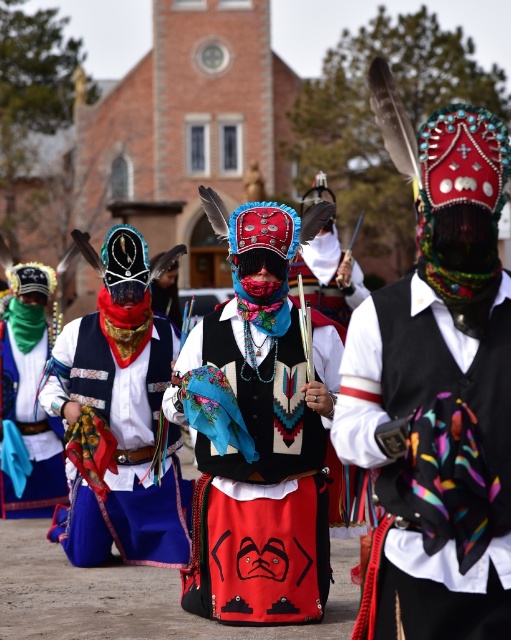
Question: Among these objects, which one is nearest to the camera?

Choices:
 (A) blue fabric skirt at center
 (B) embroidered fabric skirt at center
 (C) green satin scarf at left

Answer: (B)

Question: Among these points, which one is farthest from the camera?

Choices:
 (A) (184, 557)
 (B) (254, 506)
 (C) (39, 305)

Answer: (C)

Question: Is multicolored woven scarf at center positioned in front of green satin scarf at left?

Choices:
 (A) no
 (B) yes

Answer: (B)

Question: Considering the real-world distances, which object is closest to the multicolored woven scarf at center?

Choices:
 (A) embroidered fabric skirt at center
 (B) green satin scarf at left

Answer: (A)

Question: Can you confirm if multicolored woven scarf at center is wider than green satin scarf at left?

Choices:
 (A) yes
 (B) no

Answer: (A)

Question: Is blue fabric skirt at center closer to the viewer compared to green satin scarf at left?

Choices:
 (A) yes
 (B) no

Answer: (A)